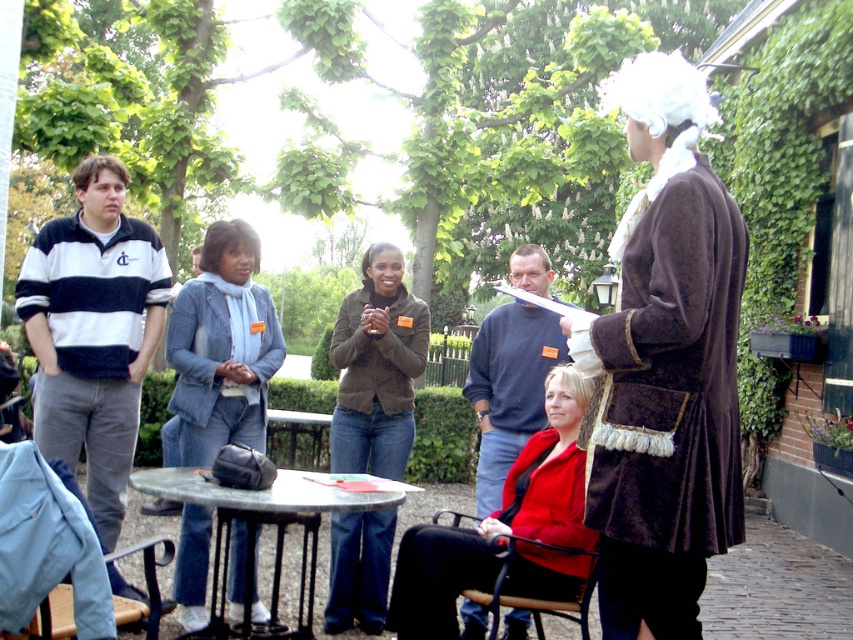
Is matte red coat at lower center taller than white fluffy wig at center?

Indeed, matte red coat at lower center has a greater height compared to white fluffy wig at center.

Locate an element on the screen. Image resolution: width=853 pixels, height=640 pixels. matte red coat at lower center is located at coordinates (495, 528).

Where is `matte red coat at lower center`? This screenshot has height=640, width=853. matte red coat at lower center is located at coordinates (495, 528).

The height and width of the screenshot is (640, 853). I want to click on matte red coat at lower center, so click(x=495, y=528).

Can you confirm if matte brown jacket at center is positioned to the right of dark gray sweater at center?

No, matte brown jacket at center is not to the right of dark gray sweater at center.

Is point (366, 456) positioned before point (514, 269)?

That is False.

Identify the location of matte brown jacket at center. The height and width of the screenshot is (640, 853). (376, 371).

Can you confirm if striped cotton polo shirt at left is positioned above metallic gray table at center?

Yes.

Consider the image. Measure the distance from striped cotton polo shirt at left to metallic gray table at center.

striped cotton polo shirt at left is 28.21 inches away from metallic gray table at center.

Who is more distant from viewer, (148,356) or (190,499)?

Positioned behind is point (148,356).

Identify the location of striped cotton polo shirt at left. The image size is (853, 640). (93, 339).